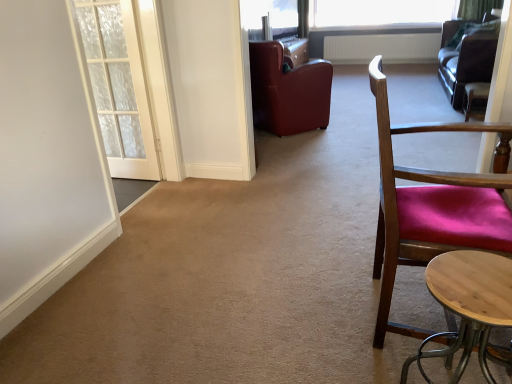
Question: Is leather at center, marked as the 2th chair in a front-to-back arrangement, to the left or to the right of velvet burgundy chair at right, arranged as the third chair when viewed from the left, in the image?

Choices:
 (A) left
 (B) right

Answer: (A)

Question: In the image, is leather at center, marked as the 2th chair in a front-to-back arrangement, positioned in front of or behind velvet burgundy chair at right, the 1th chair in the back-to-front sequence?

Choices:
 (A) front
 (B) behind

Answer: (A)

Question: Which object is positioned farthest from the white textured door at left?

Choices:
 (A) light wood round table at lower right
 (B) white textured radiator at upper center
 (C) leather couch at upper right
 (D) white sheer curtain at upper right
 (E) transparent glass window screen at upper center

Answer: (B)

Question: Estimate the real-world distances between objects in this image. Which object is farther from the transparent glass window screen at upper center?

Choices:
 (A) leather couch at upper right
 (B) transparent glass window at upper center
 (C) velvet burgundy chair at right, arranged as the third chair when viewed from the left
 (D) white textured door at left
 (E) leather at center, arranged as the second chair when viewed from the back

Answer: (D)